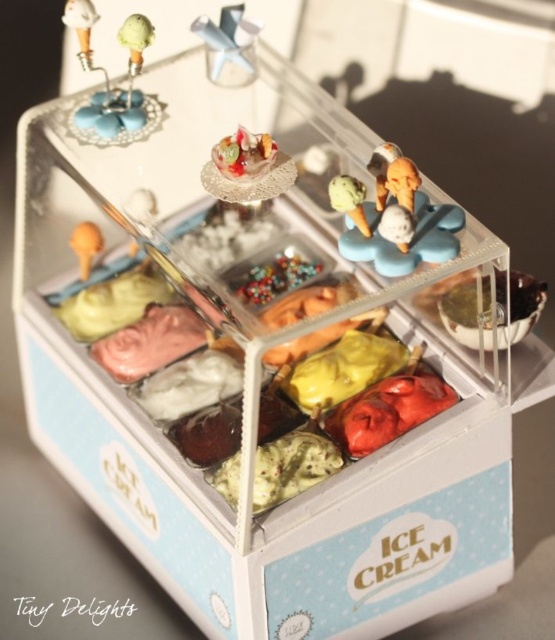
Question: Can you confirm if metallic silver spoon at upper center is positioned to the right of green matte ice cream cone at upper right?

Choices:
 (A) yes
 (B) no

Answer: (B)

Question: Considering the real-world distances, which object is closest to the translucent glass bowl at center?

Choices:
 (A) metallic silver spoon at upper center
 (B) green matte ice cream cone at upper right

Answer: (B)

Question: Which object is closer to the camera taking this photo?

Choices:
 (A) metallic silver spoon at upper center
 (B) matte plastic ice cream cones at center
 (C) green matte ice cream cone at upper right

Answer: (B)

Question: Is green matte ice cream cone at upper right wider than matte orange ice cream scoop at center?

Choices:
 (A) no
 (B) yes

Answer: (A)

Question: Which of these objects is positioned closest to the matte plastic ice cream cones at center?

Choices:
 (A) white glossy ice cream cone at upper left
 (B) translucent glass bowl at center
 (C) metallic silver spoon at upper center
 (D) green matte ice cream cone at upper right

Answer: (D)

Question: Can you confirm if matte plastic ice cream cones at center is bigger than matte orange ice cream scoop at center?

Choices:
 (A) yes
 (B) no

Answer: (A)